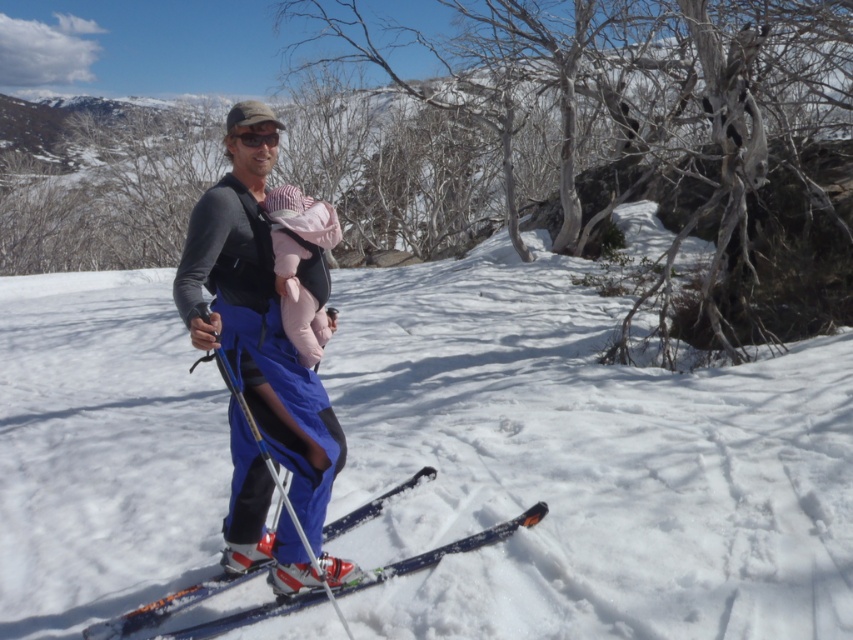
Which of these two, matte blue ski suit at center or blue metallic ski at center, stands shorter?

Standing shorter between the two is blue metallic ski at center.

Who is more forward, (210, 324) or (209, 588)?

Positioned in front is point (210, 324).

Find the location of `matte blue ski suit at center`. matte blue ski suit at center is located at coordinates (259, 376).

Consider the image. Can you confirm if white fluffy snow at center is taller than blue metallic ski at center?

Correct, white fluffy snow at center is much taller as blue metallic ski at center.

Is white fluffy snow at center thinner than blue metallic ski at center?

No.

This screenshot has width=853, height=640. What are the coordinates of `white fluffy snow at center` in the screenshot? It's located at (583, 464).

Does white fluffy snow at center have a lesser height compared to metallic silver ski pole at center?

No, white fluffy snow at center is not shorter than metallic silver ski pole at center.

Does white fluffy snow at center have a greater width compared to metallic silver ski pole at center?

Correct, the width of white fluffy snow at center exceeds that of metallic silver ski pole at center.

Measure the distance between white fluffy snow at center and camera.

white fluffy snow at center is 3.23 meters away from camera.

Find the location of a particular element. Image resolution: width=853 pixels, height=640 pixels. white fluffy snow at center is located at coordinates (583, 464).